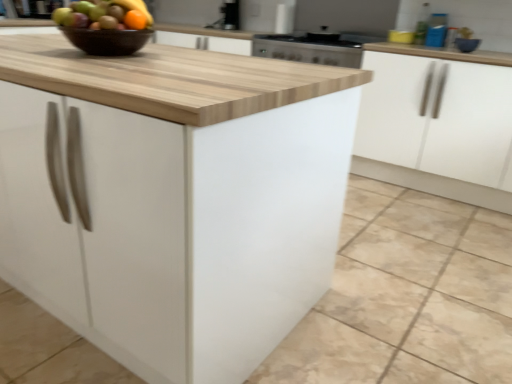
Question: Is brown glossy bowl at upper center aimed at white matte cabinet at center, which is counted as the 1th cabinetry, starting from the front?

Choices:
 (A) no
 (B) yes

Answer: (A)

Question: Can you confirm if brown glossy bowl at upper center is taller than white matte cabinet at center, the second cabinetry positioned from the back?

Choices:
 (A) yes
 (B) no

Answer: (B)

Question: Is brown glossy bowl at upper center positioned before white matte cabinet at center, the second cabinetry positioned from the back?

Choices:
 (A) no
 (B) yes

Answer: (A)

Question: From the image's perspective, would you say brown glossy bowl at upper center is shown under white matte cabinet at center, the second cabinetry positioned from the back?

Choices:
 (A) no
 (B) yes

Answer: (A)

Question: From a real-world perspective, is brown glossy bowl at upper center physically above white matte cabinet at center, the second cabinetry positioned from the back?

Choices:
 (A) yes
 (B) no

Answer: (A)

Question: From a real-world perspective, is stainless steel oven at upper center above or below white matte cabinet at right, positioned as the 2th cabinetry in front-to-back order?

Choices:
 (A) above
 (B) below

Answer: (A)

Question: Is stainless steel oven at upper center taller or shorter than white matte cabinet at right, positioned as the 2th cabinetry in front-to-back order?

Choices:
 (A) short
 (B) tall

Answer: (A)

Question: Considering the relative positions of stainless steel oven at upper center and white matte cabinet at right, placed as the first cabinetry when sorted from back to front, in the image provided, is stainless steel oven at upper center to the left or to the right of white matte cabinet at right, placed as the first cabinetry when sorted from back to front,?

Choices:
 (A) right
 (B) left

Answer: (B)

Question: Would you say stainless steel oven at upper center is inside or outside white matte cabinet at right, placed as the first cabinetry when sorted from back to front?

Choices:
 (A) outside
 (B) inside

Answer: (A)

Question: Considering their positions, is white matte cabinet at right, positioned as the 2th cabinetry in front-to-back order, located in front of or behind blue glossy bowl at upper right?

Choices:
 (A) front
 (B) behind

Answer: (A)

Question: From a real-world perspective, is white matte cabinet at right, placed as the first cabinetry when sorted from back to front, positioned above or below blue glossy bowl at upper right?

Choices:
 (A) below
 (B) above

Answer: (A)

Question: Is white matte cabinet at right, positioned as the 2th cabinetry in front-to-back order, taller or shorter than blue glossy bowl at upper right?

Choices:
 (A) short
 (B) tall

Answer: (B)

Question: Considering the positions of white matte cabinet at right, positioned as the 2th cabinetry in front-to-back order, and blue glossy bowl at upper right in the image, is white matte cabinet at right, positioned as the 2th cabinetry in front-to-back order, wider or thinner than blue glossy bowl at upper right?

Choices:
 (A) wide
 (B) thin

Answer: (A)

Question: From a real-world perspective, relative to white matte cabinet at right, placed as the first cabinetry when sorted from back to front, is white matte cabinet at center, which is counted as the 1th cabinetry, starting from the front, vertically above or below?

Choices:
 (A) below
 (B) above

Answer: (B)

Question: Is white matte cabinet at center, the second cabinetry positioned from the back, wider or thinner than white matte cabinet at right, placed as the first cabinetry when sorted from back to front?

Choices:
 (A) thin
 (B) wide

Answer: (B)